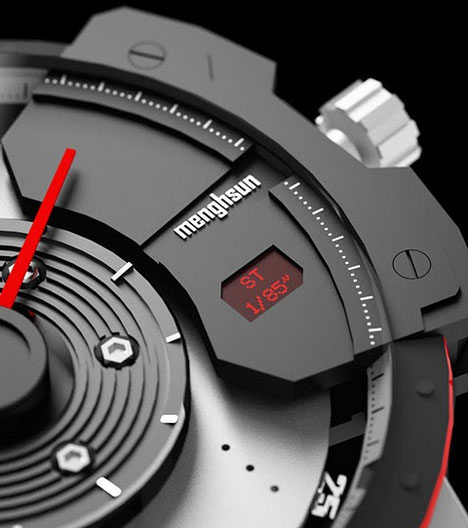
The height and width of the screenshot is (528, 468). In order to click on knob in this screenshot , I will do `click(103, 354)`, `click(390, 136)`.